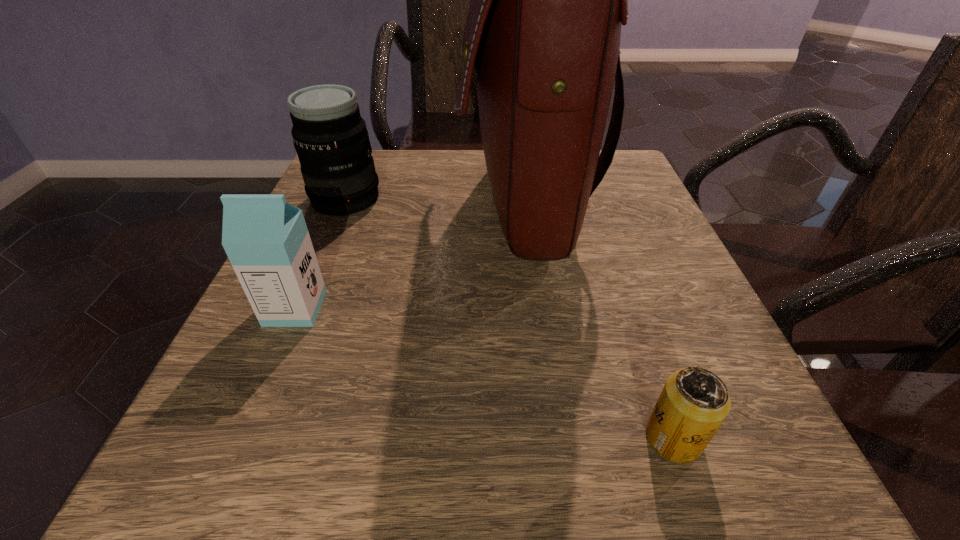
The image size is (960, 540). I want to click on object present at the near right corner, so click(x=694, y=402).

In the image, there is a desktop. Identify the location of blank space at the far edge. The width and height of the screenshot is (960, 540). (456, 157).

You are a GUI agent. You are given a task and a screenshot of the screen. Output one action in this format:
    pyautogui.click(x=<x>, y=<y>)
    Task: Click on the vacant space at the near edge of the desktop
    Image resolution: width=960 pixels, height=540 pixels.
    Given the screenshot: What is the action you would take?
    pyautogui.click(x=618, y=489)

This screenshot has height=540, width=960. I want to click on free location at the left edge of the desktop, so coord(344,281).

Find the location of a particular element. vacant space at the right edge is located at coordinates (670, 364).

You are a GUI agent. You are given a task and a screenshot of the screen. Output one action in this format:
    pyautogui.click(x=<x>, y=<y>)
    Task: Click on the vacant position at the far right corner of the desktop
    This screenshot has width=960, height=540.
    Given the screenshot: What is the action you would take?
    coord(603,192)

This screenshot has width=960, height=540. What are the coordinates of `free point between the nearest object and the milk carton` in the screenshot? It's located at (485, 373).

The height and width of the screenshot is (540, 960). I want to click on empty space that is in between the telephoto lens and the beer can, so click(x=510, y=319).

The height and width of the screenshot is (540, 960). Identify the location of empty space between the milk carton and the telephoto lens. (321, 254).

Where is `free space between the milk carton and the telephoto lens`? Image resolution: width=960 pixels, height=540 pixels. free space between the milk carton and the telephoto lens is located at coordinates (321, 254).